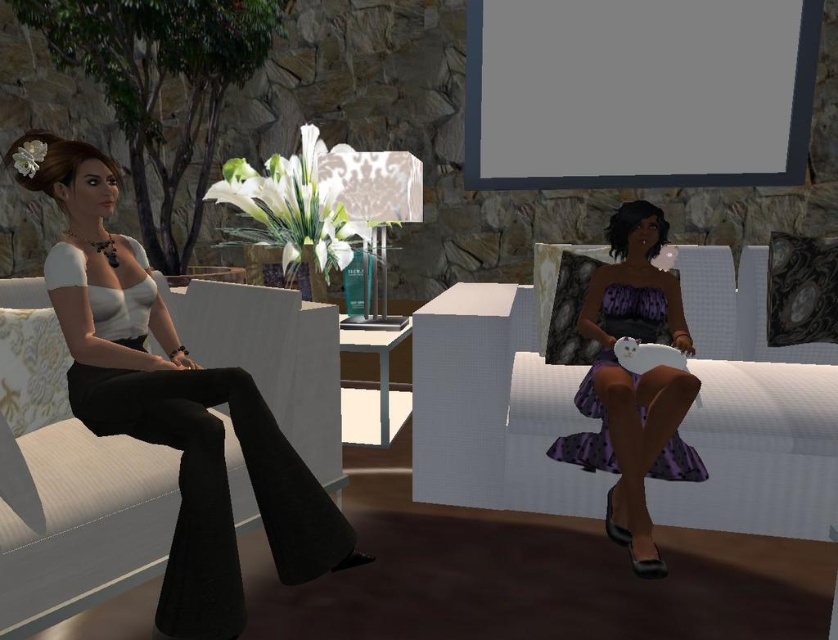
Looking at this image, you are designing a virtual space and need to ensure that the white textured couch at right can accommodate a new decorative pillow. Given that the matte black pants at left are 0.5 meters wide, can the couch fit the pillow?

The white textured couch at right is larger in size than the matte black pants at left, which are 0.5 meters wide. Since the couch is bigger, it likely has enough space to accommodate the new decorative pillow.

You are a game developer designing a virtual environment. You need to place a small decorative pillow on the object that is smaller between the white textured couch at right and the purple satin dress at right. Which object should you place the pillow on?

The purple satin dress at right is smaller than the white textured couch at right, so you should place the small decorative pillow on the purple satin dress at right.

You are a game character trying to reach the purple satin dress at right without moving the white textured couch at right. Is this possible?

The purple satin dress at right is behind the white textured couch at right, so you cannot reach it without moving the couch.